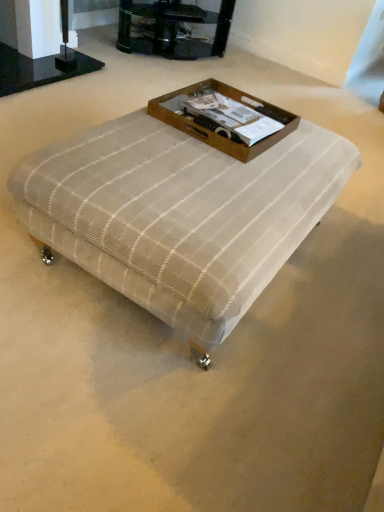
Question: Considering the positions of plaid fabric ottoman at center and brown wooden tray at center in the image, is plaid fabric ottoman at center taller or shorter than brown wooden tray at center?

Choices:
 (A) short
 (B) tall

Answer: (B)

Question: Is plaid fabric ottoman at center situated inside brown wooden tray at center or outside?

Choices:
 (A) inside
 (B) outside

Answer: (B)

Question: Estimate the real-world distances between objects in this image. Which object is closer to the plaid fabric ottoman at center?

Choices:
 (A) brown wooden tray at center
 (B) clear glass tv stand at upper center

Answer: (A)

Question: Based on their relative distances, which object is farther from the brown wooden tray at center?

Choices:
 (A) clear glass tv stand at upper center
 (B) plaid fabric ottoman at center

Answer: (A)